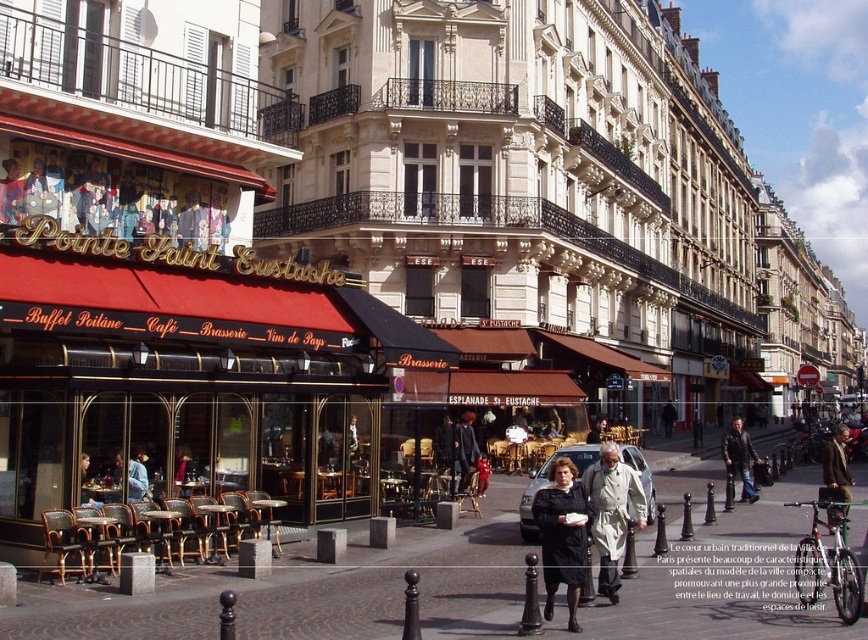
Question: Does brown leather jacket at center-right have a lesser width compared to light blue fabric jacket at center?

Choices:
 (A) yes
 (B) no

Answer: (B)

Question: Is light beige trench coat at center bigger than dark gray suit at center?

Choices:
 (A) no
 (B) yes

Answer: (B)

Question: Does brown wooden tables at lower center appear over brown leather jacket at center-right?

Choices:
 (A) yes
 (B) no

Answer: (A)

Question: Which object appears closest to the camera in this image?

Choices:
 (A) black fabric coat at center
 (B) leather jacket at center
 (C) brown leather jacket at center-right

Answer: (A)

Question: Among these objects, which one is farthest from the camera?

Choices:
 (A) brown leather jacket at center-right
 (B) matte black jacket at center

Answer: (A)

Question: Which point is farther from the camera taking this photo?

Choices:
 (A) (571, 616)
 (B) (838, 432)
 (C) (137, 484)
 (D) (95, 500)

Answer: (B)